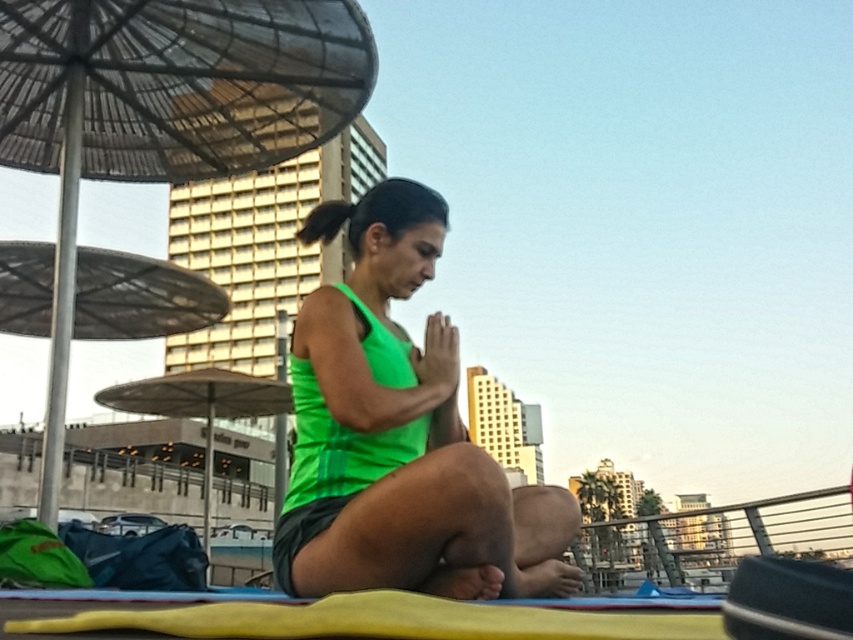
You are standing on the rooftop where the woman is practicing yoga. You want to place a small potted plant between the two points marked as point (537, 540) and point (123, 170). Which point should the plant be closer to so it is nearer to the camera?

The plant should be placed closer to point (537, 540) because it is closer to the camera than point (123, 170).

You are a photographer trying to capture the woman in the scene. You notice the green matte tank top at center and the metallic umbrella at upper left. Which object would appear larger in your photo?

The green matte tank top at center would appear larger in the photo since it is bigger than the metallic umbrella at upper left.

You are a photographer planning to take a portrait of the woman in the scene. You want to ensure her green matte tank top at center is fully visible without any obstruction from the metallic umbrella at upper left. Based on the scene description, can you confirm if this is possible?

The green matte tank top at center is below the metallic umbrella at upper left, so the metallic umbrella at upper left is positioned above it. This means the metallic umbrella at upper left would not obstruct the view of the green matte tank top at center from a frontal angle, making it possible to capture the tank top without obstruction.